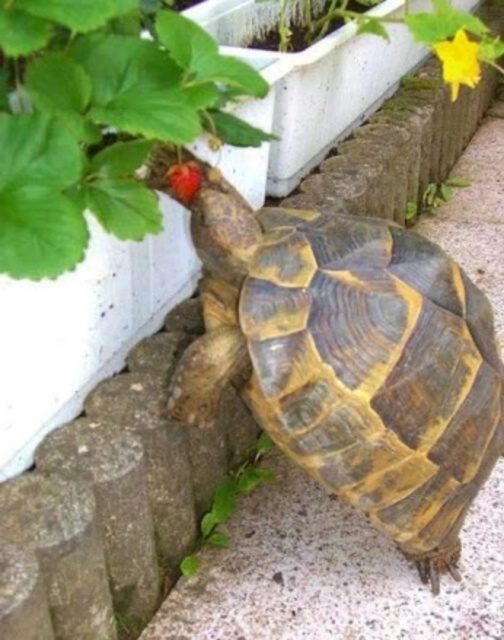
You are a photographer aiming to capture the tortoise and the strawberry in the image. You want to ensure both subjects are in focus. Given that your camera can only focus on one point at a time, which point should you choose to maximize the chance of both being in focus? Please choose between point A at coordinates point [232,97] and point B at coordinates point [215,532].

You should choose point A at coordinates point [232,97] because it is closer to the viewer than point B at coordinates point [215,532]. Focusing on the closer point increases the likelihood of both subjects being in focus due to the depth of field extending further behind the focal point.

You are a gardener who wants to place a small decorative rock next to the brown textured tortoise at center and the ripe red berry at center. If the rock is 3 inches wide, which object will it fit next to without overlapping?

The rock will fit next to the ripe red berry at center because the brown textured tortoise at center is wider than the berry.

You are a gardener who wants to place a small decorative statue exactly halfway between the brown textured tortoise at center and the yellow matte flower at upper right. Considering their sizes, will the statue fit without overlapping either object?

The brown textured tortoise at center is larger in width than the yellow matte flower at upper right. Since the statue is placed exactly halfway between them, the distance between the two objects must be at least twice the statue width to avoid overlap. However, without knowing the exact distance between them, we cannot confirm if the statue will fit without overlapping. Please measure the space first.